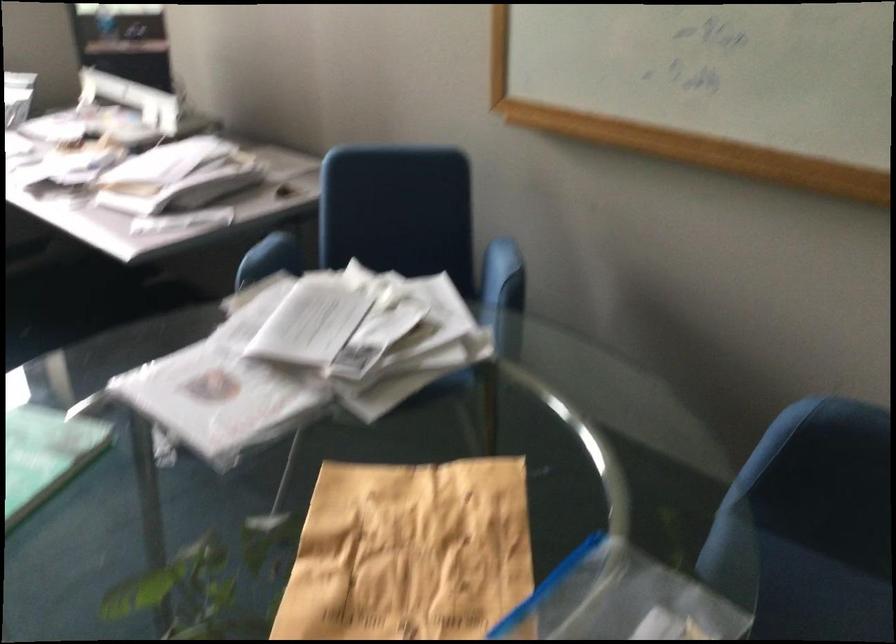
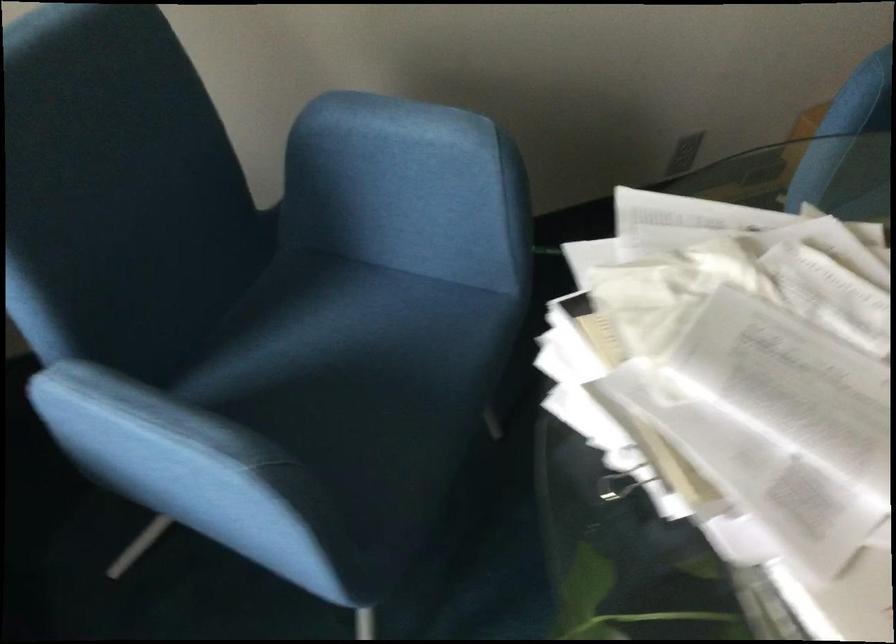
Find the pixel in the second image that matches (x=483, y=265) in the first image.

(394, 140)